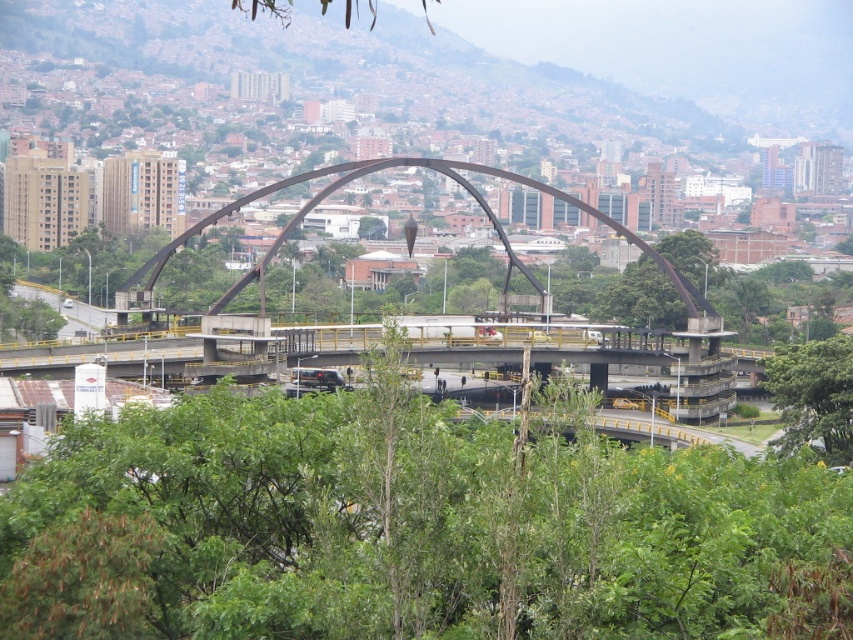
Question: Which of the following is the farthest from the observer?

Choices:
 (A) green leafy tree at lower right
 (B) metallic bridge at center
 (C) green leafy tree at center

Answer: (B)

Question: Which object is positioned closest to the green leafy tree at center?

Choices:
 (A) green leafy tree at lower right
 (B) metallic bridge at center

Answer: (A)

Question: Observing the image, what is the correct spatial positioning of metallic bridge at center in reference to green leafy tree at lower right?

Choices:
 (A) above
 (B) below

Answer: (A)

Question: Observing the image, what is the correct spatial positioning of green leafy tree at center in reference to metallic bridge at center?

Choices:
 (A) above
 (B) below

Answer: (B)

Question: Which object appears farthest from the camera in this image?

Choices:
 (A) green leafy tree at lower right
 (B) metallic bridge at center

Answer: (B)

Question: Does green leafy tree at center come behind metallic bridge at center?

Choices:
 (A) yes
 (B) no

Answer: (B)